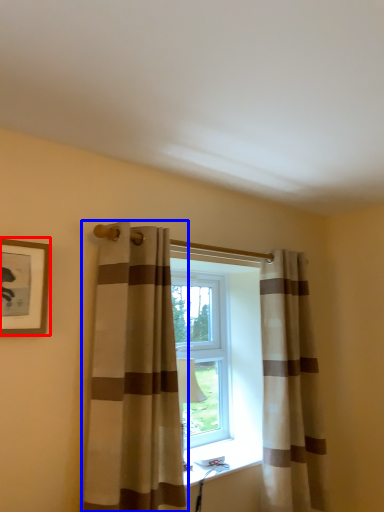
Question: Which point is closer to the camera, picture frame (highlighted by a red box) or curtain (highlighted by a blue box)?

Choices:
 (A) picture frame
 (B) curtain

Answer: (A)